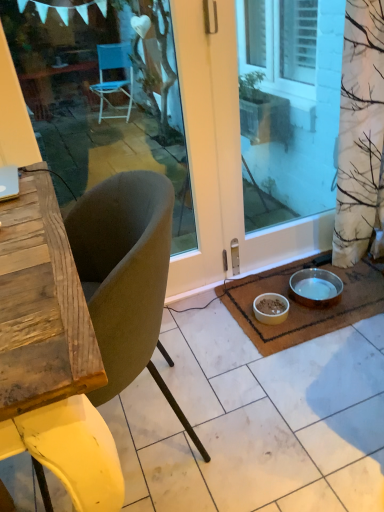
You are a GUI agent. You are given a task and a screenshot of the screen. Output one action in this format:
    pyautogui.click(x=<x>, y=<y>)
    Task: Click on the vacant space to the right of white matte bowl at lower center, positioned as the second bowl in right-to-left order
    The width and height of the screenshot is (384, 512).
    Given the screenshot: What is the action you would take?
    [x=317, y=323]